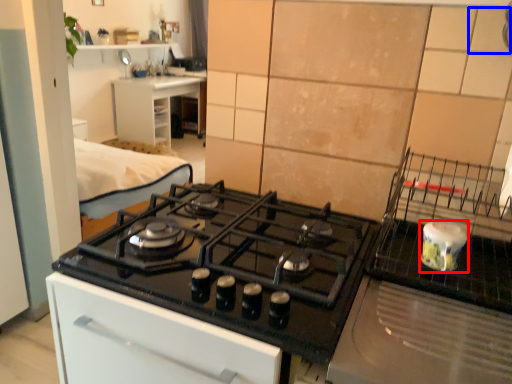
Question: Which of the following is the closest to the observer, kitchen appliance (highlighted by a red box) or tile (highlighted by a blue box)?

Choices:
 (A) kitchen appliance
 (B) tile

Answer: (B)